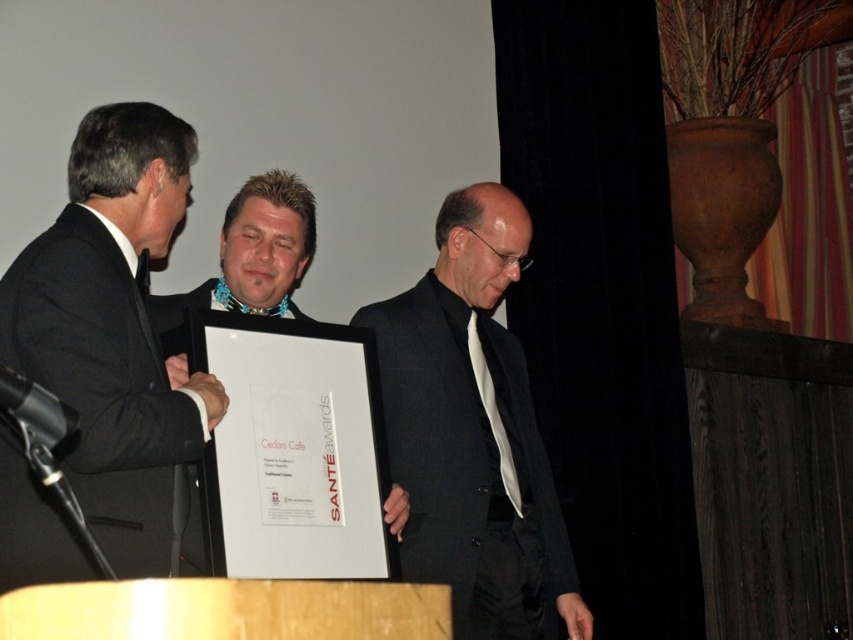
Does black suit at left appear under matte black suit at center?

Actually, black suit at left is above matte black suit at center.

Who is more forward, (88,168) or (392,349)?

Point (88,168) is more forward.

This screenshot has width=853, height=640. In order to click on black suit at left in this screenshot , I will do `click(115, 333)`.

Where is `black suit at left`? This screenshot has height=640, width=853. black suit at left is located at coordinates (115, 333).

Measure the distance from matte black suit at center to matte black frame at center.

matte black suit at center is 22.60 inches from matte black frame at center.

Does matte black suit at center have a lesser height compared to matte black frame at center?

Incorrect, matte black suit at center's height does not fall short of matte black frame at center's.

Is point (393, 368) positioned after point (260, 268)?

That is False.

Where is `matte black suit at center`? matte black suit at center is located at coordinates point(473,433).

Which is more to the right, black suit at left or matte black frame at center?

matte black frame at center

Can you confirm if black suit at left is positioned to the right of matte black frame at center?

Incorrect, black suit at left is not on the right side of matte black frame at center.

The image size is (853, 640). What do you see at coordinates (115, 333) in the screenshot? I see `black suit at left` at bounding box center [115, 333].

Find the location of `black suit at left`. black suit at left is located at coordinates click(x=115, y=333).